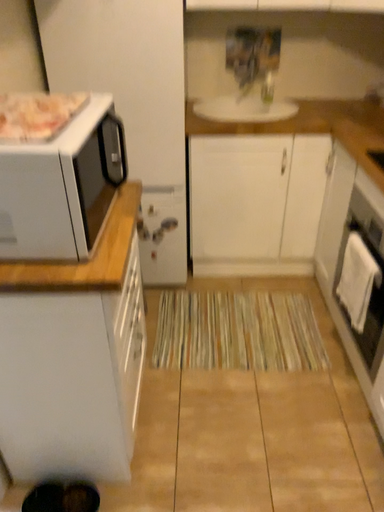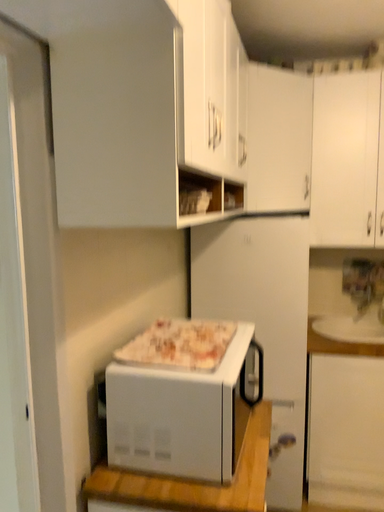
Question: How did the camera likely rotate when shooting the video?

Choices:
 (A) rotated left
 (B) rotated right

Answer: (A)